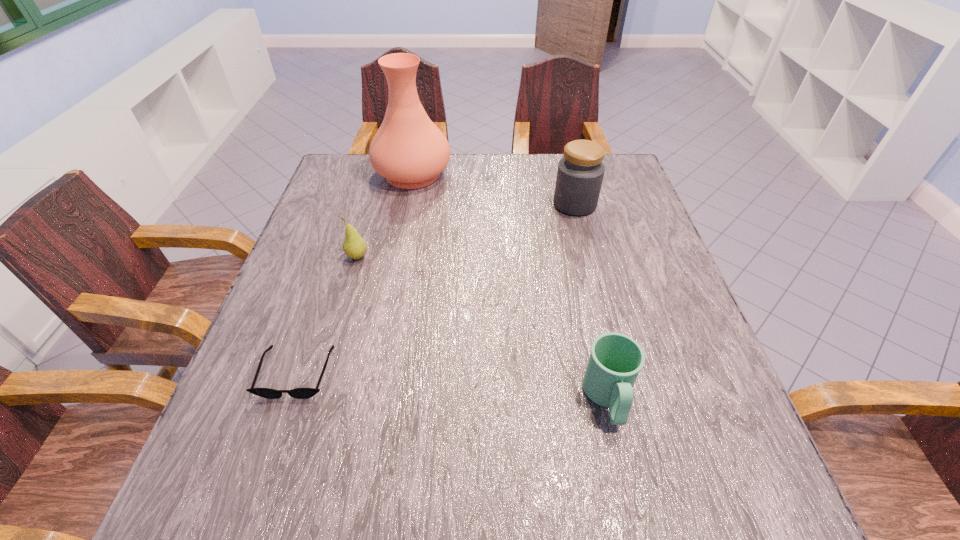
Where is `free area in between the tallest object and the mug`? The image size is (960, 540). free area in between the tallest object and the mug is located at coordinates (510, 286).

You are a GUI agent. You are given a task and a screenshot of the screen. Output one action in this format:
    pyautogui.click(x=<x>, y=<y>)
    Task: Click on the unoccupied area between the vase and the third farthest object
    The height and width of the screenshot is (540, 960).
    Given the screenshot: What is the action you would take?
    pyautogui.click(x=385, y=215)

Identify the location of vacant area that lies between the shortest object and the vase. The height and width of the screenshot is (540, 960). (354, 273).

Where is `free space between the fourth shortest object and the shortest object`? Image resolution: width=960 pixels, height=540 pixels. free space between the fourth shortest object and the shortest object is located at coordinates (436, 288).

Find the location of `free space between the pear and the vase`. free space between the pear and the vase is located at coordinates (385, 215).

I want to click on free spot between the sunglasses and the vase, so click(354, 273).

Locate an element on the screen. The image size is (960, 540). vacant point located between the mug and the sunglasses is located at coordinates (452, 386).

You are a GUI agent. You are given a task and a screenshot of the screen. Output one action in this format:
    pyautogui.click(x=<x>, y=<y>)
    Task: Click on the free space between the pear and the mug
    The height and width of the screenshot is (540, 960).
    Given the screenshot: What is the action you would take?
    pyautogui.click(x=483, y=328)

This screenshot has height=540, width=960. I want to click on object that is the third nearest to the third farthest object, so click(x=580, y=173).

Identify the location of object that stands as the second closest to the vase. (580, 173).